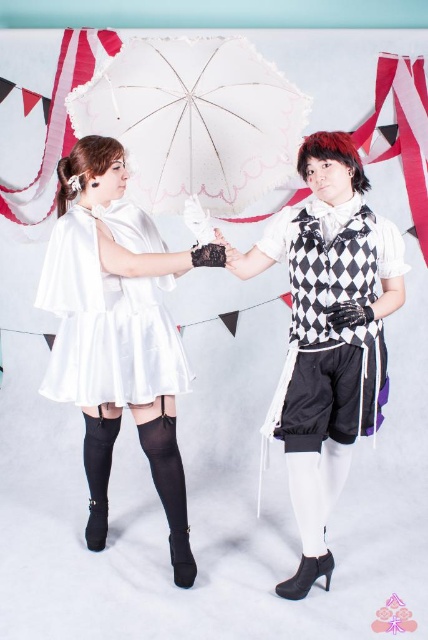
Question: Is white lace umbrella at center positioned at the back of black and white checkered vest at right?

Choices:
 (A) no
 (B) yes

Answer: (A)

Question: Does white satin dress at left appear on the left side of black and white checkered vest at right?

Choices:
 (A) no
 (B) yes

Answer: (B)

Question: Which is farther from the white lace umbrella at center?

Choices:
 (A) white satin dress at left
 (B) white satin dress at center
 (C) matte black vest at center
 (D) black and white checkered vest at right

Answer: (D)

Question: Among these objects, which one is farthest from the camera?

Choices:
 (A) white satin dress at center
 (B) matte black vest at center
 (C) white lace umbrella at center

Answer: (A)

Question: Which object is closer to the camera taking this photo?

Choices:
 (A) white satin dress at center
 (B) matte black vest at center
 (C) white lace umbrella at center

Answer: (C)

Question: Does white lace umbrella at center appear under white satin dress at center?

Choices:
 (A) yes
 (B) no

Answer: (B)